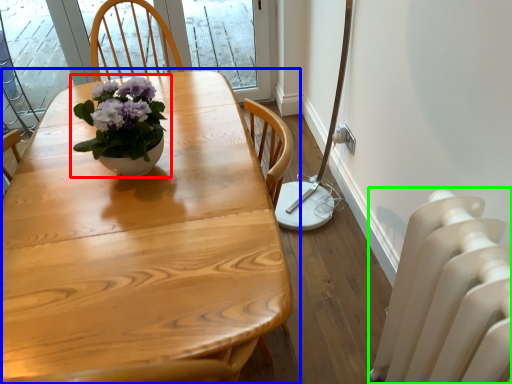
Question: Which object is the farthest from houseplant (highlighted by a red box)? Choose among these: table (highlighted by a blue box) or radiator (highlighted by a green box).

Choices:
 (A) table
 (B) radiator

Answer: (B)